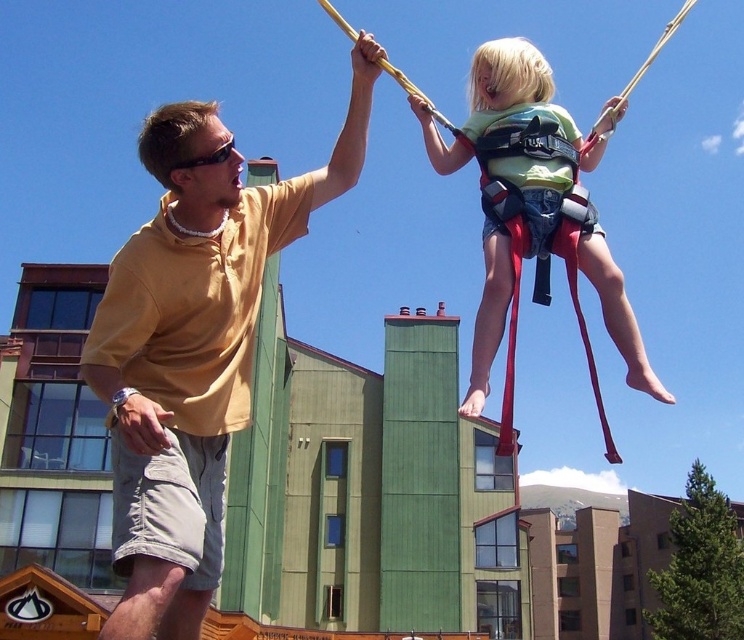
Question: Which point is farther to the camera?

Choices:
 (A) [x=231, y=138]
 (B) [x=490, y=307]
 (C) [x=202, y=388]

Answer: (B)

Question: Can you confirm if matte yellow shirt at center is positioned to the right of green fabric harness at upper center?

Choices:
 (A) yes
 (B) no

Answer: (B)

Question: Is green fabric harness at upper center below black plastic goggles at upper center?

Choices:
 (A) no
 (B) yes

Answer: (B)

Question: Which object appears closest to the camera in this image?

Choices:
 (A) black plastic goggles at upper center
 (B) green fabric harness at upper center

Answer: (A)

Question: Which object appears closest to the camera in this image?

Choices:
 (A) green fabric harness at upper center
 (B) black plastic goggles at upper center
 (C) matte yellow shirt at center

Answer: (C)

Question: Is green fabric harness at upper center bigger than black plastic goggles at upper center?

Choices:
 (A) no
 (B) yes

Answer: (B)